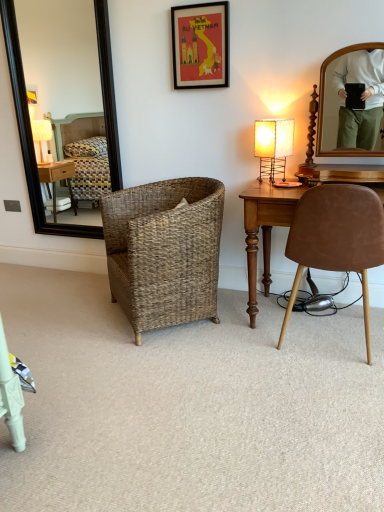
I want to click on vacant location below brown suede chair at right, arranged as the first chair when viewed from the right (from a real-world perspective), so click(331, 348).